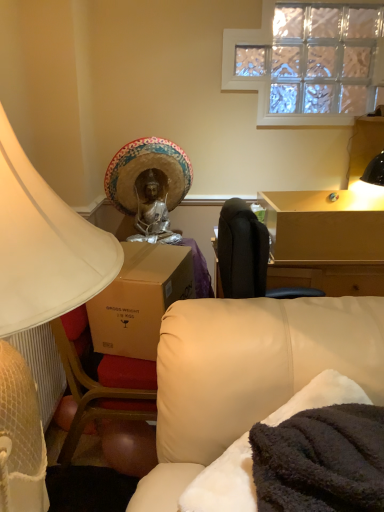
Where is `straw hat at upper center`? The height and width of the screenshot is (512, 384). straw hat at upper center is located at coordinates (147, 170).

Image resolution: width=384 pixels, height=512 pixels. What do you see at coordinates (44, 246) in the screenshot?
I see `white matte lampshade at left` at bounding box center [44, 246].

In order to face clear glass window at upper center, should I rotate leftwards or rightwards?

You should rotate right by 15.203 degrees.

This screenshot has height=512, width=384. What do you see at coordinates (326, 242) in the screenshot? I see `light brown wooden table at upper right` at bounding box center [326, 242].

I want to click on straw hat at upper center, so pyautogui.click(x=147, y=170).

Is clear glass window at upper center in contact with white matte lampshade at left?

clear glass window at upper center and white matte lampshade at left are not in contact.

Which object is further away from the camera taking this photo, clear glass window at upper center or white matte lampshade at left?

Positioned behind is clear glass window at upper center.

Considering the positions of point (344, 20) and point (26, 212), is point (344, 20) closer or farther from the camera than point (26, 212)?

Clearly, point (344, 20) is more distant from the camera than point (26, 212).

Is clear glass window at upper center positioned with its back to white matte lampshade at left?

No, clear glass window at upper center's orientation is not away from white matte lampshade at left.

From the image's perspective, which is below, light brown wooden table at upper right or leather couch at lower right?

leather couch at lower right appears lower in the image.

Which object is positioned more to the left, light brown wooden table at upper right or leather couch at lower right?

From the viewer's perspective, leather couch at lower right appears more on the left side.

Is leather couch at lower right at the back of light brown wooden table at upper right?

No, light brown wooden table at upper right's orientation is not away from leather couch at lower right.

Does light brown wooden table at upper right lie behind leather couch at lower right?

That is True.

Is clear glass window at upper center facing towards light brown wooden table at upper right?

No, clear glass window at upper center is not aimed at light brown wooden table at upper right.

Is light brown wooden table at upper right a part of clear glass window at upper center?

Definitely not — light brown wooden table at upper right is not inside clear glass window at upper center.

Is white matte lampshade at left positioned before leather couch at lower right?

Yes, white matte lampshade at left is closer to the camera.

Is white matte lampshade at left wider than leather couch at lower right?

Yes, white matte lampshade at left is wider than leather couch at lower right.

How different are the orientations of white matte lampshade at left and leather couch at lower right in degrees?

43.6 degrees.

Who is bigger, white matte lampshade at left or leather couch at lower right?

white matte lampshade at left is bigger.

Is straw hat at upper center outside of leather couch at lower right?

Yes, straw hat at upper center is not within leather couch at lower right.

Which is more to the right, straw hat at upper center or leather couch at lower right?

Positioned to the right is leather couch at lower right.

From the image's perspective, is straw hat at upper center above or below leather couch at lower right?

Based on their image positions, straw hat at upper center is located above leather couch at lower right.

Which object is wider, straw hat at upper center or leather couch at lower right?

Wider between the two is straw hat at upper center.

From a real-world perspective, who is located higher, leather couch at lower right or white matte lampshade at left?

white matte lampshade at left is physically above.

Is leather couch at lower right in contact with white matte lampshade at left?

No, leather couch at lower right is not making contact with white matte lampshade at left.

What's the angular difference between leather couch at lower right and white matte lampshade at left's facing directions?

The facing directions of leather couch at lower right and white matte lampshade at left are 43.6 degrees apart.

Does point (322, 355) come behind point (49, 306)?

Yes.

Does straw hat at upper center turn towards clear glass window at upper center?

No, straw hat at upper center is not aimed at clear glass window at upper center.

Is straw hat at upper center not inside clear glass window at upper center?

straw hat at upper center lies outside clear glass window at upper center's area.

Is straw hat at upper center closer to camera compared to clear glass window at upper center?

Yes, straw hat at upper center is in front of clear glass window at upper center.

Can you tell me how much straw hat at upper center and clear glass window at upper center differ in facing direction?

0.000704 degrees separate the facing orientations of straw hat at upper center and clear glass window at upper center.

Where is `window behind the white matte lampshade at left`? window behind the white matte lampshade at left is located at coordinates (308, 62).

What are the coordinates of `studio couch in front of the light brown wooden table at upper right` in the screenshot? It's located at (247, 373).

When comparing their distances from light brown wooden table at upper right, does white matte lampshade at left or clear glass window at upper center seem closer?

clear glass window at upper center is positioned closer to the anchor light brown wooden table at upper right.

From the image, which object appears to be farther from straw hat at upper center, light brown wooden table at upper right or clear glass window at upper center?

clear glass window at upper center lies further to straw hat at upper center than the other object.

Estimate the real-world distances between objects in this image. Which object is further from light brown wooden table at upper right, white matte lampshade at left or straw hat at upper center?

white matte lampshade at left.

Which object lies nearer to the anchor point clear glass window at upper center, leather couch at lower right or white matte lampshade at left?

leather couch at lower right lies closer to clear glass window at upper center than the other object.

In the scene shown: Looking at the image, which one is located further to leather couch at lower right, clear glass window at upper center or white matte lampshade at left?

clear glass window at upper center is further to leather couch at lower right.

Based on their spatial positions, is straw hat at upper center or light brown wooden table at upper right further from white matte lampshade at left?

Among the two, straw hat at upper center is located further to white matte lampshade at left.

Based on their spatial positions, is leather couch at lower right or clear glass window at upper center closer to straw hat at upper center?

clear glass window at upper center lies closer to straw hat at upper center than the other object.

Looking at the image, which one is located closer to straw hat at upper center, leather couch at lower right or light brown wooden table at upper right?

light brown wooden table at upper right lies closer to straw hat at upper center than the other object.

Locate an element on the screen. studio couch between white matte lampshade at left and light brown wooden table at upper right in the front-back direction is located at coordinates (247, 373).

Identify the location of studio couch between white matte lampshade at left and straw hat at upper center in the front-back direction. This screenshot has height=512, width=384. (247, 373).

I want to click on window between straw hat at upper center and light brown wooden table at upper right from left to right, so click(308, 62).

The image size is (384, 512). What are the coordinates of `studio couch positioned between white matte lampshade at left and clear glass window at upper center from near to far` in the screenshot? It's located at (247, 373).